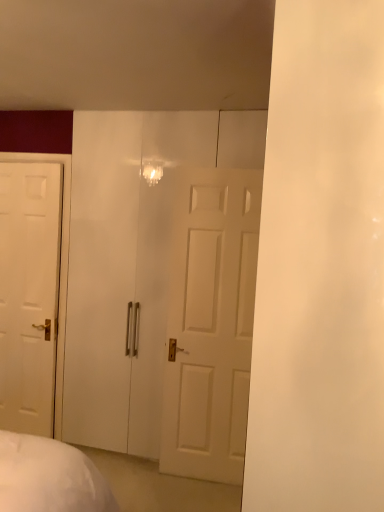
Question: Is white glossy door at left bigger or smaller than transparent glass door at center?

Choices:
 (A) big
 (B) small

Answer: (B)

Question: Choose the correct answer: Is white glossy door at left inside transparent glass door at center or outside it?

Choices:
 (A) inside
 (B) outside

Answer: (B)

Question: Considering the positions of point (29, 321) and point (215, 187), is point (29, 321) closer or farther from the camera than point (215, 187)?

Choices:
 (A) farther
 (B) closer

Answer: (A)

Question: Based on their sizes in the image, would you say transparent glass door at center is bigger or smaller than white glossy door at left?

Choices:
 (A) big
 (B) small

Answer: (A)

Question: From the image's perspective, is transparent glass door at center positioned above or below white glossy door at left?

Choices:
 (A) below
 (B) above

Answer: (B)

Question: In terms of height, does transparent glass door at center look taller or shorter compared to white glossy door at left?

Choices:
 (A) short
 (B) tall

Answer: (B)

Question: Relative to white glossy door at left, is transparent glass door at center in front or behind?

Choices:
 (A) front
 (B) behind

Answer: (A)